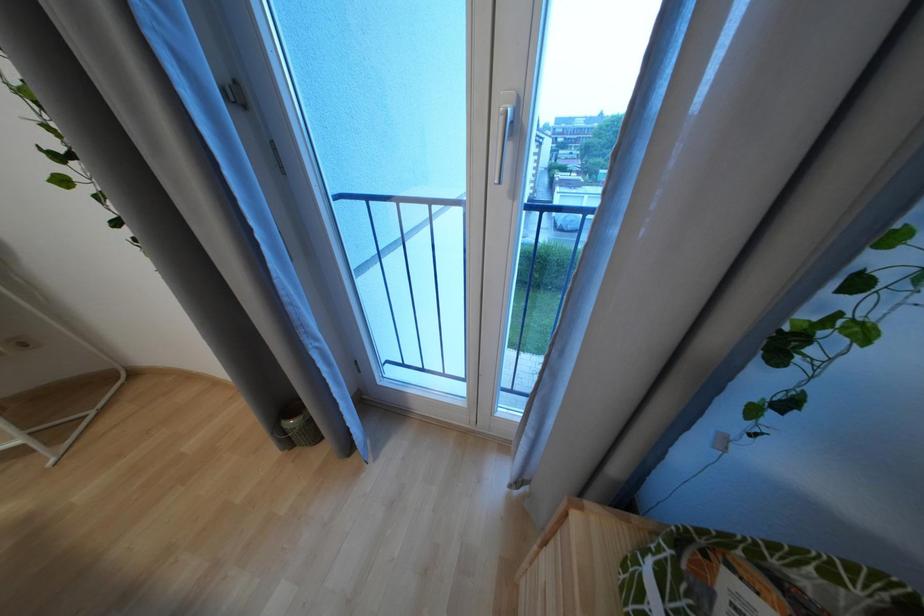
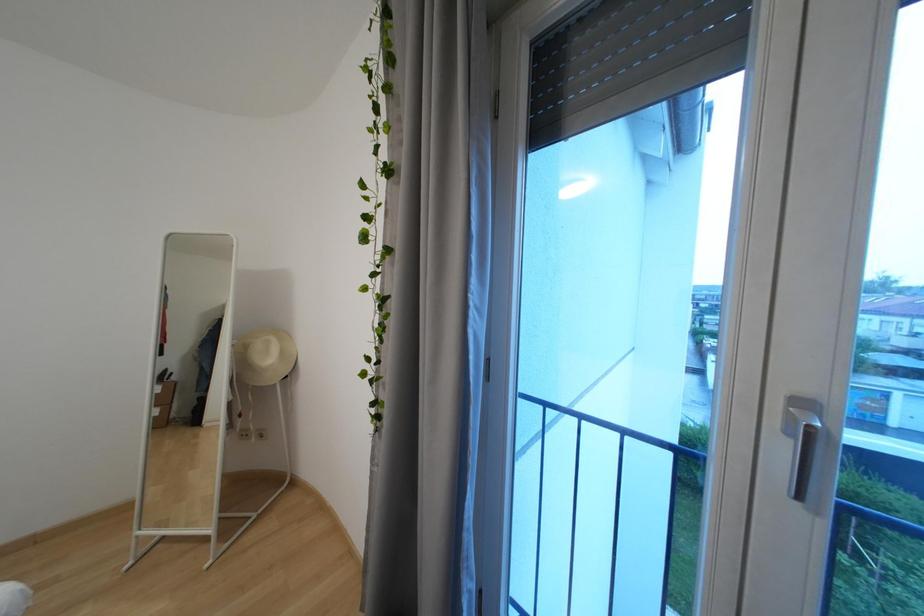
The images are taken continuously from a first-person perspective. In which direction is your viewpoint rotating?

The camera's rotation is toward left-up.